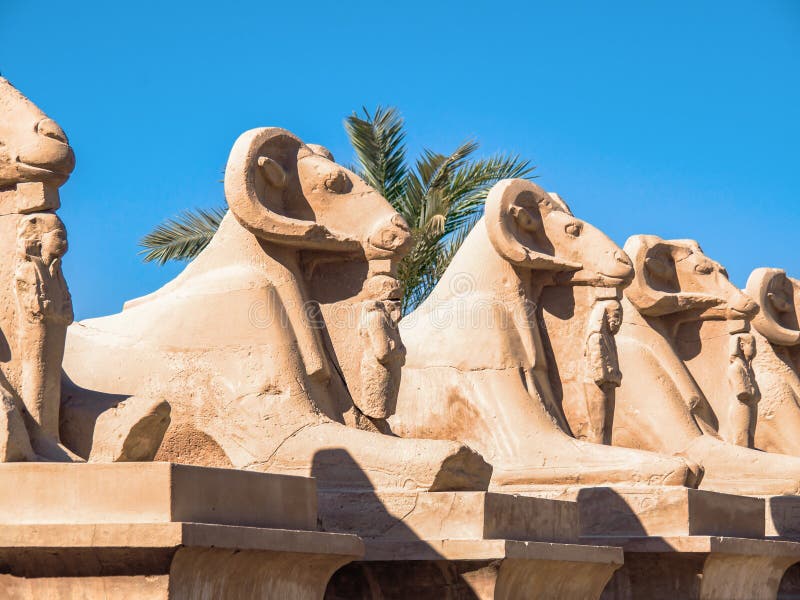
Identify the location of statue bases. (256, 573), (502, 578), (692, 569).